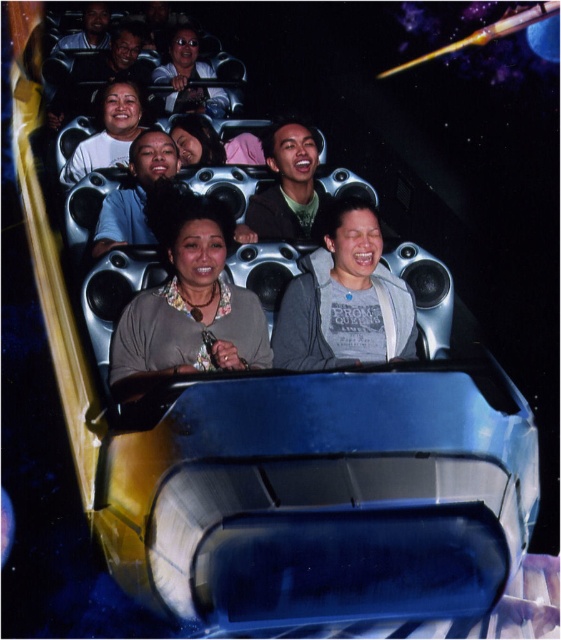
Between point (172, 193) and point (168, 70), which one is positioned in front?

Positioned in front is point (172, 193).

Does matte gray sweater at center appear over matte black jacket at upper center?

No.

Who is more distant from viewer, (206,323) or (190,42)?

Positioned behind is point (190,42).

Find the location of a particular element. matte gray sweater at center is located at coordinates (188, 304).